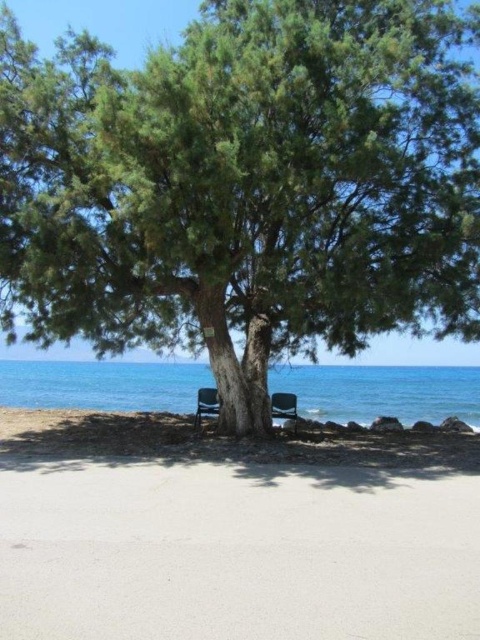
Is green textured tree at center positioned behind green plastic chair at lower center?

No, green textured tree at center is in front of green plastic chair at lower center.

Which is behind, point (271, 12) or point (273, 392)?

The point (273, 392) is more distant.

Is point (400, 172) closer to viewer compared to point (273, 392)?

Yes.

The image size is (480, 640). I want to click on green textured tree at center, so click(x=244, y=186).

Which of these two, brown sand at lower center or green plastic chair at lower center, stands taller?

Standing taller between the two is brown sand at lower center.

Can you confirm if brown sand at lower center is thinner than green plastic chair at lower center?

Incorrect, brown sand at lower center's width is not less than green plastic chair at lower center's.

What do you see at coordinates (225, 440) in the screenshot? The height and width of the screenshot is (640, 480). I see `brown sand at lower center` at bounding box center [225, 440].

In order to click on brown sand at lower center in this screenshot , I will do `click(225, 440)`.

Is sandy beige beach at lower center thinner than black plastic chair at lower center?

No, sandy beige beach at lower center is not thinner than black plastic chair at lower center.

The height and width of the screenshot is (640, 480). What do you see at coordinates (231, 536) in the screenshot?
I see `sandy beige beach at lower center` at bounding box center [231, 536].

Does point (290, 500) come closer to viewer compared to point (208, 392)?

Yes, point (290, 500) is closer to viewer.

In order to click on sandy beige beach at lower center in this screenshot , I will do `click(231, 536)`.